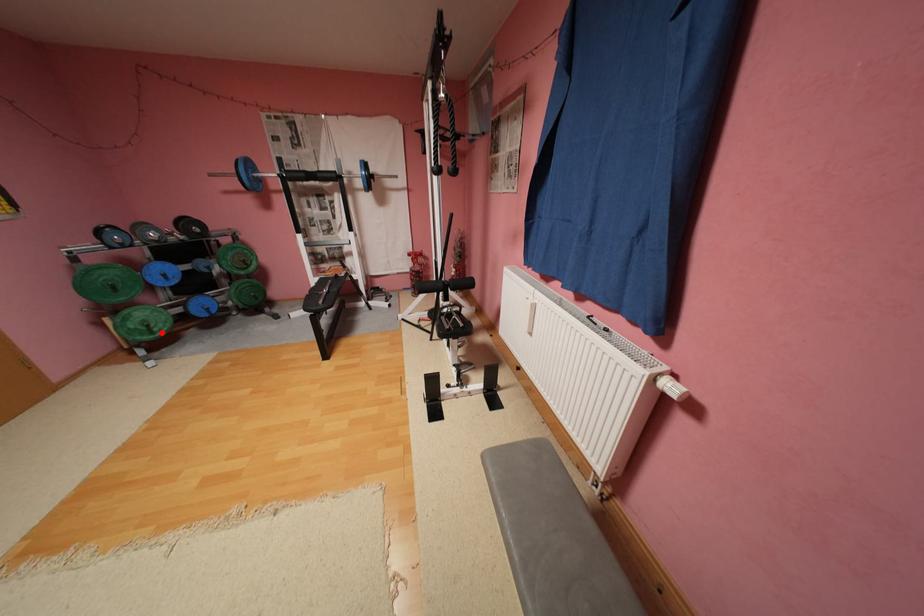
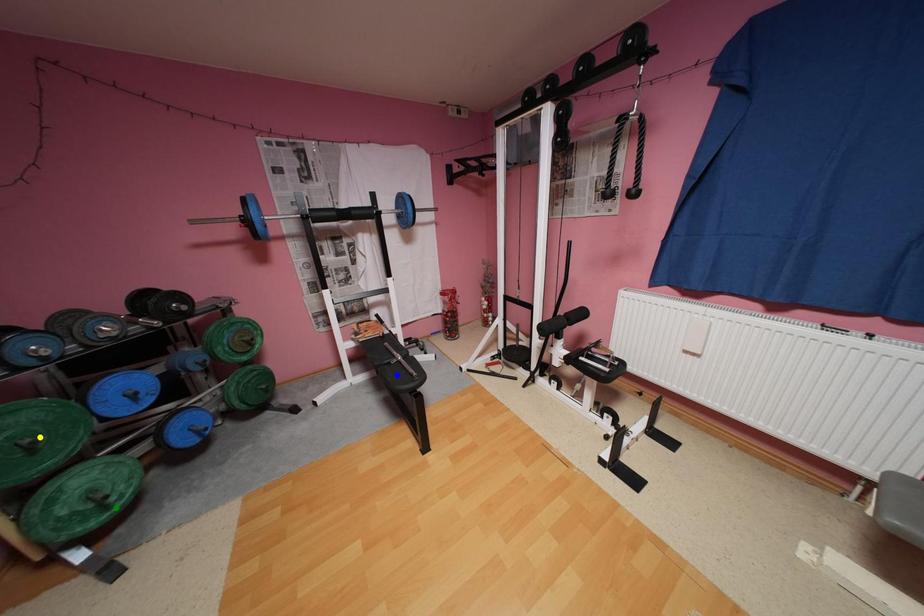
Question: I am providing you with two images of the same scene from different viewpoints. A red point is marked on the first image. You are given multiple points on the second image. Which mark in image 2 goes with the point in image 1?

Choices:
 (A) yellow point
 (B) blue point
 (C) green point

Answer: (C)